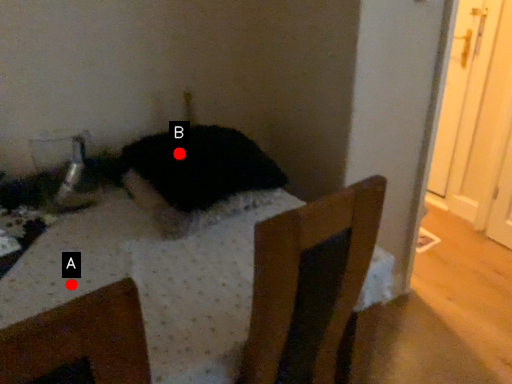
Question: Two points are circled on the image, labeled by A and B beside each circle. Which point is farther from the camera taking this photo?

Choices:
 (A) A is further
 (B) B is further

Answer: (B)